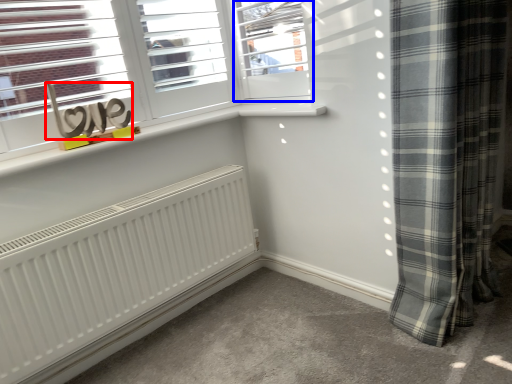
Question: Which object appears farthest to the camera in this image, writing (highlighted by a red box) or window (highlighted by a blue box)?

Choices:
 (A) writing
 (B) window

Answer: (B)